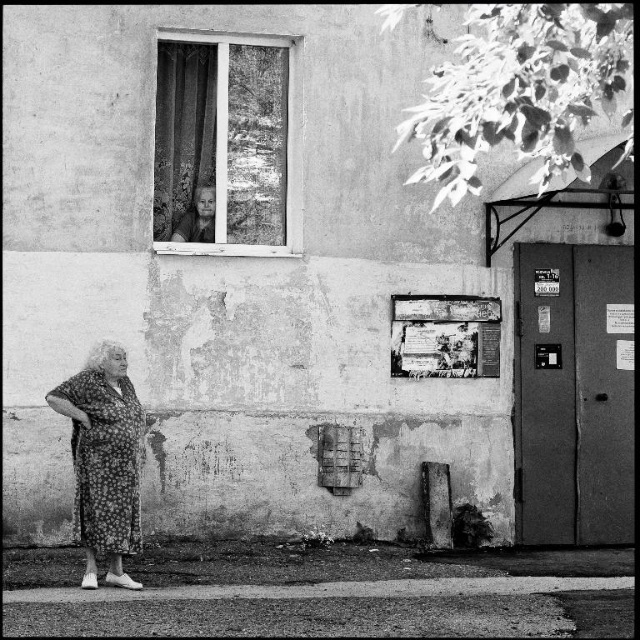
Question: In this image, where is wooden frame window at upper center located relative to floral dress at lower left?

Choices:
 (A) right
 (B) left

Answer: (A)

Question: Which of the following is the farthest from the observer?

Choices:
 (A) (193, 220)
 (B) (51, 390)

Answer: (A)

Question: Does floral dress at lower left appear under smooth asphalt curb at lower center?

Choices:
 (A) yes
 (B) no

Answer: (B)

Question: Is wooden frame window at upper center above floral dress at lower left?

Choices:
 (A) yes
 (B) no

Answer: (A)

Question: Which point appears farthest from the camera in this image?

Choices:
 (A) (108, 368)
 (B) (504, 584)

Answer: (B)

Question: Which point is farther to the camera?

Choices:
 (A) wooden frame window at upper center
 (B) smooth asphalt curb at lower center
 (C) floral dress at lower left

Answer: (A)